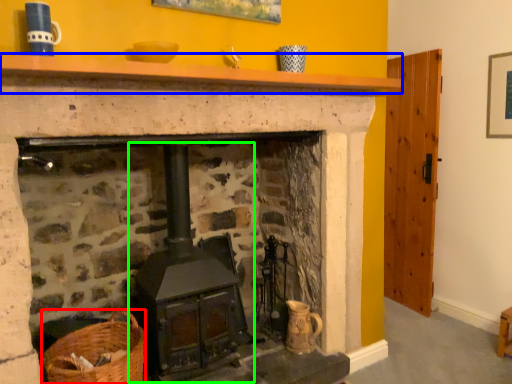
Question: Which object is the closest to the basket (highlighted by a red box)? Choose among these: mantle (highlighted by a blue box) or stove (highlighted by a green box).

Choices:
 (A) mantle
 (B) stove

Answer: (B)